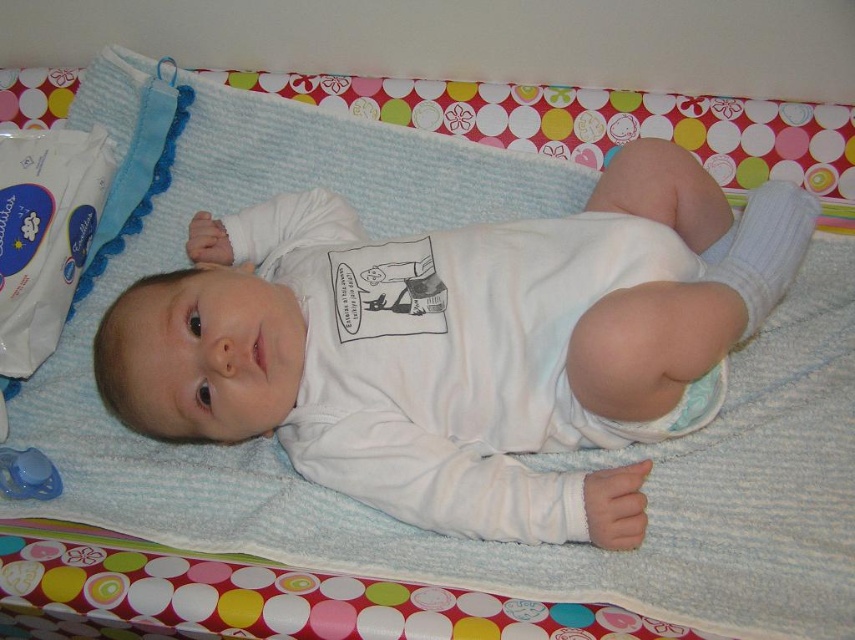
I want to click on white soft baby at center, so tap(461, 342).

Is white soft baby at center wider than white cloth diaper at center?

Correct, the width of white soft baby at center exceeds that of white cloth diaper at center.

Is point (404, 467) less distant than point (575, 413)?

Yes, point (404, 467) is closer to viewer.

Identify the location of white soft baby at center. (461, 342).

Between white soft baby at center and blue plastic pacifier at lower left, which one is positioned lower?

blue plastic pacifier at lower left is lower down.

The width and height of the screenshot is (855, 640). What do you see at coordinates (461, 342) in the screenshot?
I see `white soft baby at center` at bounding box center [461, 342].

Is point (696, 196) less distant than point (28, 452)?

No, (696, 196) is further to viewer.

Image resolution: width=855 pixels, height=640 pixels. Find the location of `white soft baby at center`. white soft baby at center is located at coordinates (461, 342).

How much distance is there between white cloth diaper at center and blue plastic pacifier at lower left?

25.75 inches

Is point (610, 420) positioned in front of point (18, 472)?

Yes, point (610, 420) is closer to viewer.

Where is `white cloth diaper at center`? white cloth diaper at center is located at coordinates (632, 420).